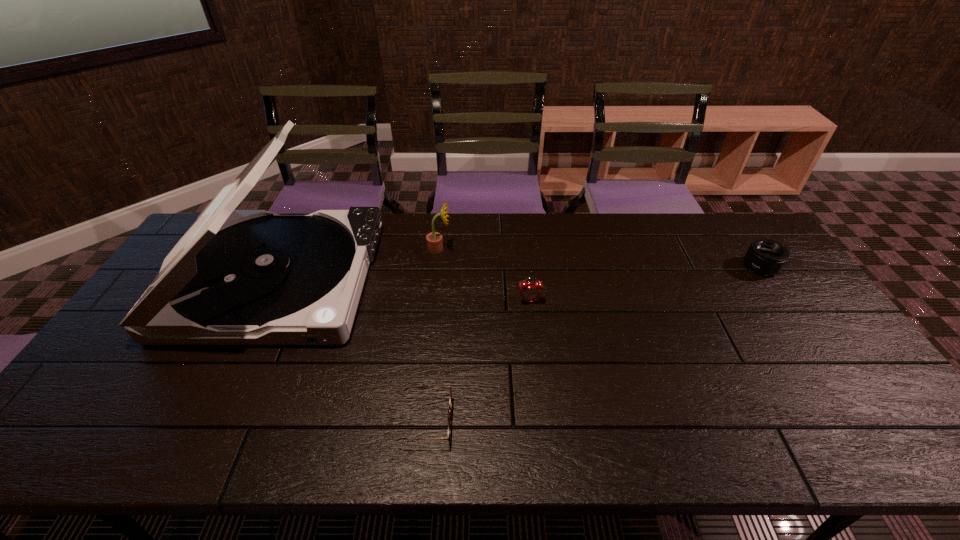
Locate an element on the screen. This screenshot has height=540, width=960. free point between the rightmost object and the fourth shortest object is located at coordinates (600, 258).

The image size is (960, 540). Identify the location of vacant space that's between the CD player and the second shortest object. (519, 273).

The image size is (960, 540). Find the location of `free space that is in between the third tallest object and the nearest object`. free space that is in between the third tallest object and the nearest object is located at coordinates (478, 361).

The width and height of the screenshot is (960, 540). Identify the location of free space between the tallest object and the second object from right to left. (403, 290).

The image size is (960, 540). In order to click on free space between the second object from right to left and the telephoto lens in this screenshot , I will do `click(645, 284)`.

The image size is (960, 540). In order to click on vacant space that is in between the nearest object and the third tallest object in this screenshot , I will do `click(478, 361)`.

Where is `blank region between the fourth shortest object and the second shortest object`? Image resolution: width=960 pixels, height=540 pixels. blank region between the fourth shortest object and the second shortest object is located at coordinates (600, 258).

You are a GUI agent. You are given a task and a screenshot of the screen. Output one action in this format:
    pyautogui.click(x=<x>, y=<y>)
    Task: Click on the unoccupied position between the alarm clock and the leftmost object
    This screenshot has width=960, height=540.
    Given the screenshot: What is the action you would take?
    pyautogui.click(x=403, y=290)

The height and width of the screenshot is (540, 960). In order to click on the second closest object to the second shortest object in this screenshot , I will do `click(434, 240)`.

At what (x,y) coordinates should I click in order to perform the action: click on object that is the fourth nearest to the third tallest object. Please return your answer as a coordinate pair (x, y). Image resolution: width=960 pixels, height=540 pixels. Looking at the image, I should click on (764, 256).